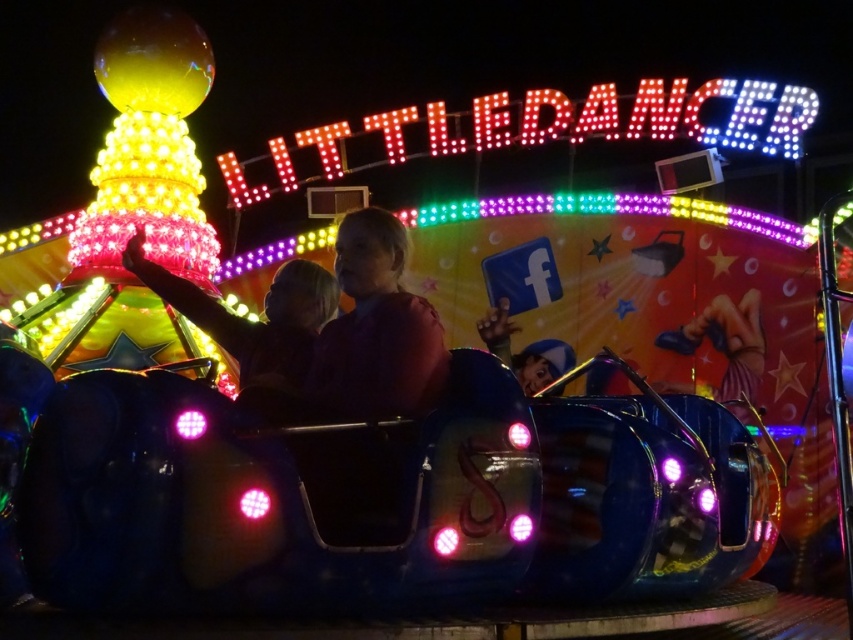
Can you confirm if pink matte shirt at center is positioned below shiny metallic car at center?

Correct, pink matte shirt at center is located below shiny metallic car at center.

Does pink matte shirt at center appear over shiny metallic car at center?

No, pink matte shirt at center is not above shiny metallic car at center.

This screenshot has width=853, height=640. Find the location of `pink matte shirt at center`. pink matte shirt at center is located at coordinates (376, 328).